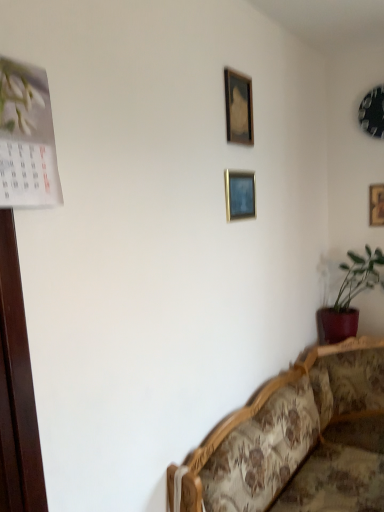
Find the location of a particular element. Image resolution: width=384 pixels, height=512 pixels. green matte plant at lower right is located at coordinates (349, 297).

The width and height of the screenshot is (384, 512). What do you see at coordinates (376, 205) in the screenshot?
I see `wooden picture frame at right, acting as the 1th picture frame starting from the back` at bounding box center [376, 205].

Where is `metallic clock at upper right, the third picture frame in the front-to-back sequence`? metallic clock at upper right, the third picture frame in the front-to-back sequence is located at coordinates (372, 112).

Measure the distance between matte wooden picture frame at upper center, arranged as the second picture frame when viewed from the left, and camera.

matte wooden picture frame at upper center, arranged as the second picture frame when viewed from the left, and camera are 1.69 meters apart from each other.

Where is `wooden picture frame at upper center, which appears as the 1th picture frame when viewed from the front`? Image resolution: width=384 pixels, height=512 pixels. wooden picture frame at upper center, which appears as the 1th picture frame when viewed from the front is located at coordinates (238, 106).

Considering their positions, is wooden picture frame at upper center, the 4th picture frame in the back-to-front sequence, located in front of or behind matte wooden picture frame at upper center, acting as the 3th picture frame starting from the right?

Clearly, wooden picture frame at upper center, the 4th picture frame in the back-to-front sequence, is in front of matte wooden picture frame at upper center, acting as the 3th picture frame starting from the right.

The image size is (384, 512). Identify the location of picture frame that is the 1st object above the matte wooden picture frame at upper center, arranged as the second picture frame when viewed from the left (from a real-world perspective). (238, 106).

Which point is more forward, (x=244, y=122) or (x=243, y=217)?

The point (x=244, y=122) is closer.

The image size is (384, 512). In order to click on the 1st picture frame located above the green matte plant at lower right (from a real-world perspective) in this screenshot , I will do `click(376, 205)`.

Is point (338, 340) closer to viewer compared to point (381, 225)?

Yes, it is in front of point (381, 225).

Does green matte plant at lower right have a greater height compared to wooden picture frame at right, placed as the fourth picture frame when sorted from left to right?

Indeed, green matte plant at lower right has a greater height compared to wooden picture frame at right, placed as the fourth picture frame when sorted from left to right.

Is wooden picture frame at right, the first picture frame in the right-to-left sequence, completely or partially inside green matte plant at lower right?

No.

From the picture: How different are the orientations of matte wooden picture frame at upper center, the third picture frame viewed from the back, and wooden picture frame at right, placed as the fourth picture frame when sorted from left to right, in degrees?

matte wooden picture frame at upper center, the third picture frame viewed from the back, and wooden picture frame at right, placed as the fourth picture frame when sorted from left to right, are facing 90.2 degrees away from each other.

Can you confirm if matte wooden picture frame at upper center, the third picture frame viewed from the back, is smaller than wooden picture frame at right, acting as the 1th picture frame starting from the back?

No.

How far apart are matte wooden picture frame at upper center, arranged as the second picture frame when viewed from the left, and wooden picture frame at right, placed as the fourth picture frame when sorted from left to right?

1.17 meters.

Is matte wooden picture frame at upper center, the third picture frame viewed from the back, placed right next to wooden picture frame at right, placed as the fourth picture frame when sorted from left to right?

matte wooden picture frame at upper center, the third picture frame viewed from the back, and wooden picture frame at right, placed as the fourth picture frame when sorted from left to right, are clearly separated.

Looking at this image, would you consider green matte plant at lower right to be distant from metallic clock at upper right, the 2th picture frame from the right?

Actually, green matte plant at lower right and metallic clock at upper right, the 2th picture frame from the right, are a little close together.

Would you say green matte plant at lower right is outside metallic clock at upper right, the third picture frame in the front-to-back sequence?

Yes, green matte plant at lower right is located beyond the bounds of metallic clock at upper right, the third picture frame in the front-to-back sequence.

From a real-world perspective, which object rests below the other?

In real-world perspective, green matte plant at lower right is lower.

Considering the sizes of objects green matte plant at lower right and metallic clock at upper right, positioned as the 2th picture frame in back-to-front order, in the image provided, who is smaller, green matte plant at lower right or metallic clock at upper right, positioned as the 2th picture frame in back-to-front order,?

With smaller size is metallic clock at upper right, positioned as the 2th picture frame in back-to-front order.

Considering the sizes of objects metallic clock at upper right, the 2th picture frame from the right, and floral fabric couch at lower right in the image provided, who is wider, metallic clock at upper right, the 2th picture frame from the right, or floral fabric couch at lower right?

floral fabric couch at lower right.

Does metallic clock at upper right, the 2th picture frame from the right, have a larger size compared to floral fabric couch at lower right?

No.

Consider the image. Is floral fabric couch at lower right a part of metallic clock at upper right, acting as the third picture frame starting from the left?

No, floral fabric couch at lower right is not inside metallic clock at upper right, acting as the third picture frame starting from the left.

Can you see metallic clock at upper right, the 2th picture frame from the right, touching floral fabric couch at lower right?

They are not placed beside each other.

Is wooden picture frame at right, the first picture frame in the right-to-left sequence, bigger than metallic clock at upper right, acting as the third picture frame starting from the left?

Incorrect, wooden picture frame at right, the first picture frame in the right-to-left sequence, is not larger than metallic clock at upper right, acting as the third picture frame starting from the left.

Measure the distance between wooden picture frame at right, the fourth picture frame from the front, and metallic clock at upper right, positioned as the 2th picture frame in back-to-front order.

wooden picture frame at right, the fourth picture frame from the front, and metallic clock at upper right, positioned as the 2th picture frame in back-to-front order, are 41.76 centimeters apart from each other.

The height and width of the screenshot is (512, 384). In order to click on picture frame lying behind the metallic clock at upper right, the third picture frame in the front-to-back sequence in this screenshot , I will do `click(376, 205)`.

Is wooden picture frame at right, acting as the 1th picture frame starting from the back, facing away from metallic clock at upper right, the 2th picture frame from the right?

That's not correct — wooden picture frame at right, acting as the 1th picture frame starting from the back, is not looking away from metallic clock at upper right, the 2th picture frame from the right.

How distant is wooden picture frame at right, the fourth picture frame from the front, from matte wooden picture frame at upper center, acting as the 3th picture frame starting from the right?

A distance of 3.84 feet exists between wooden picture frame at right, the fourth picture frame from the front, and matte wooden picture frame at upper center, acting as the 3th picture frame starting from the right.

Which object is wider, wooden picture frame at right, acting as the 1th picture frame starting from the back, or matte wooden picture frame at upper center, the 2th picture frame from the front?

wooden picture frame at right, acting as the 1th picture frame starting from the back, is wider.

Image resolution: width=384 pixels, height=512 pixels. In order to click on picture frame that is the 2nd one when counting rightward from the matte wooden picture frame at upper center, arranged as the second picture frame when viewed from the left in this screenshot , I will do `click(376, 205)`.

What's the angular difference between wooden picture frame at right, the first picture frame in the right-to-left sequence, and matte wooden picture frame at upper center, the third picture frame viewed from the back,'s facing directions?

There is a 90.2-degree angle between the facing directions of wooden picture frame at right, the first picture frame in the right-to-left sequence, and matte wooden picture frame at upper center, the third picture frame viewed from the back.

Locate an element on the screen. picture frame in front of the matte wooden picture frame at upper center, the 2th picture frame from the front is located at coordinates (238, 106).

You are a GUI agent. You are given a task and a screenshot of the screen. Output one action in this format:
    pyautogui.click(x=<x>, y=<y>)
    Task: Click on the houseplant below the wooden picture frame at right, placed as the fourth picture frame when sorted from left to right (from a real-world perspective)
    The image size is (384, 512).
    Given the screenshot: What is the action you would take?
    pyautogui.click(x=349, y=297)

From the image, which object appears to be nearer to metallic clock at upper right, acting as the third picture frame starting from the left, green matte plant at lower right or wooden picture frame at right, placed as the fourth picture frame when sorted from left to right?

The object closer to metallic clock at upper right, acting as the third picture frame starting from the left, is wooden picture frame at right, placed as the fourth picture frame when sorted from left to right.

Looking at this image, when comparing their distances from floral fabric couch at lower right, does wooden picture frame at right, the first picture frame in the right-to-left sequence, or green matte plant at lower right seem further?

The object further to floral fabric couch at lower right is wooden picture frame at right, the first picture frame in the right-to-left sequence.

When comparing their distances from metallic clock at upper right, the third picture frame in the front-to-back sequence, does wooden picture frame at right, the fourth picture frame from the front, or floral fabric couch at lower right seem further?

Based on the image, floral fabric couch at lower right appears to be further to metallic clock at upper right, the third picture frame in the front-to-back sequence.

When comparing their distances from green matte plant at lower right, does wooden picture frame at upper center, which appears as the 1th picture frame when viewed from the front, or wooden picture frame at right, the fourth picture frame from the front, seem closer?

Among the two, wooden picture frame at right, the fourth picture frame from the front, is located nearer to green matte plant at lower right.

Which object lies further to the anchor point wooden picture frame at upper center, the fourth picture frame from the right, green matte plant at lower right or matte wooden picture frame at upper center, the 2th picture frame from the front?

green matte plant at lower right lies further to wooden picture frame at upper center, the fourth picture frame from the right, than the other object.

Looking at the image, which one is located further to floral fabric couch at lower right, green matte plant at lower right or wooden picture frame at upper center, which appears as the 1th picture frame when viewed from the front?

wooden picture frame at upper center, which appears as the 1th picture frame when viewed from the front.

Estimate the real-world distances between objects in this image. Which object is further from wooden picture frame at right, the fourth picture frame from the front, floral fabric couch at lower right or metallic clock at upper right, acting as the third picture frame starting from the left?

Based on the image, floral fabric couch at lower right appears to be further to wooden picture frame at right, the fourth picture frame from the front.

From the image, which object appears to be nearer to metallic clock at upper right, positioned as the 2th picture frame in back-to-front order, wooden picture frame at upper center, the 1th picture frame positioned from the left, or wooden picture frame at right, the fourth picture frame from the front?

wooden picture frame at right, the fourth picture frame from the front.

This screenshot has height=512, width=384. Identify the location of houseplant situated between wooden picture frame at upper center, the 4th picture frame in the back-to-front sequence, and wooden picture frame at right, placed as the fourth picture frame when sorted from left to right, from left to right. (349, 297).

Where is `houseplant between wooden picture frame at upper center, the 4th picture frame in the back-to-front sequence, and floral fabric couch at lower right from top to bottom`? houseplant between wooden picture frame at upper center, the 4th picture frame in the back-to-front sequence, and floral fabric couch at lower right from top to bottom is located at coordinates (349, 297).

The width and height of the screenshot is (384, 512). In order to click on houseplant between metallic clock at upper right, the third picture frame in the front-to-back sequence, and floral fabric couch at lower right in the up-down direction in this screenshot , I will do `click(349, 297)`.

You are a GUI agent. You are given a task and a screenshot of the screen. Output one action in this format:
    pyautogui.click(x=<x>, y=<y>)
    Task: Click on the picture frame located between wooden picture frame at upper center, the 4th picture frame in the back-to-front sequence, and green matte plant at lower right in the left-right direction
    
    Given the screenshot: What is the action you would take?
    pyautogui.click(x=240, y=195)